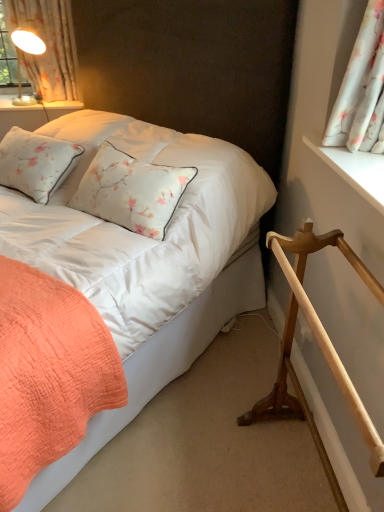
The image size is (384, 512). What do you see at coordinates (321, 323) in the screenshot?
I see `light brown wooden rail at lower right` at bounding box center [321, 323].

In order to face coral quilted bed at lower left, should I rotate leftwards or rightwards?

You should rotate left by 19.149 degrees.

Describe the element at coordinates (145, 262) in the screenshot. The image size is (384, 512). I see `coral quilted bed at lower left` at that location.

What is the approximate width of white wooden window sill at upper right?

white wooden window sill at upper right is 7.84 inches in width.

Identify the location of light brown wooden rail at lower right. The height and width of the screenshot is (512, 384). (321, 323).

Considering the points (288, 325) and (339, 144), which point is in front, point (288, 325) or point (339, 144)?

Positioned in front is point (288, 325).

Is light brown wooden rail at lower right not within white floral fabric at upper right, which is the first curtain in bottom-to-top order?

light brown wooden rail at lower right is positioned outside white floral fabric at upper right, which is the first curtain in bottom-to-top order.

Can you confirm if light brown wooden rail at lower right is bigger than white floral fabric at upper right, which is counted as the first curtain, starting from the front?

Correct, light brown wooden rail at lower right is larger in size than white floral fabric at upper right, which is counted as the first curtain, starting from the front.

From the picture: Is light brown wooden rail at lower right behind white floral fabric at upper right, the 2th curtain when ordered from back to front?

No, the depth of light brown wooden rail at lower right is less than that of white floral fabric at upper right, the 2th curtain when ordered from back to front.

Are light brown wooden rail at lower right and coral quilted bed at lower left far apart?

No.

From a real-world perspective, relative to coral quilted bed at lower left, is light brown wooden rail at lower right vertically above or below?

light brown wooden rail at lower right is below coral quilted bed at lower left.

From the image's perspective, is light brown wooden rail at lower right over coral quilted bed at lower left?

No, from the image's perspective, light brown wooden rail at lower right is not above coral quilted bed at lower left.

Considering the relative positions of light brown wooden rail at lower right and coral quilted bed at lower left in the image provided, is light brown wooden rail at lower right to the right of coral quilted bed at lower left from the viewer's perspective?

Correct, you'll find light brown wooden rail at lower right to the right of coral quilted bed at lower left.

Consider the image. Does white wooden window sill at upper right have a lesser width compared to white floral fabric at upper left, which ranks as the 2th curtain in right-to-left order?

Correct, the width of white wooden window sill at upper right is less than that of white floral fabric at upper left, which ranks as the 2th curtain in right-to-left order.

Considering the positions of points (363, 189) and (21, 19), is point (363, 189) closer to camera compared to point (21, 19)?

Yes, it is in front of point (21, 19).

Is white wooden window sill at upper right positioned with its back to white floral fabric at upper left, the first curtain in the top-to-bottom sequence?

That's not correct — white wooden window sill at upper right is not looking away from white floral fabric at upper left, the first curtain in the top-to-bottom sequence.

Between white wooden window sill at upper right and white floral fabric at upper left, which ranks as the first curtain in back-to-front order, which one appears on the right side from the viewer's perspective?

white wooden window sill at upper right.

Can you confirm if white wooden window sill at upper right is shorter than white floral fabric at upper right, which is counted as the first curtain, starting from the front?

Yes.

How different are the orientations of white wooden window sill at upper right and white floral fabric at upper right, the 2th curtain when ordered from back to front, in degrees?

The angular difference between white wooden window sill at upper right and white floral fabric at upper right, the 2th curtain when ordered from back to front, is 0.00205 degrees.

From the image's perspective, relative to white floral fabric at upper right, the 2th curtain when ordered from back to front, is white wooden window sill at upper right above or below?

Clearly, from the image's perspective, white wooden window sill at upper right is below white floral fabric at upper right, the 2th curtain when ordered from back to front.

Locate an element on the screen. curtain lying on the right of white wooden window sill at upper right is located at coordinates pos(359,82).

From the image's perspective, which is below, white floral fabric at upper left, which ranks as the first curtain in back-to-front order, or white floral fabric at upper right, the 2th curtain when ordered from back to front?

white floral fabric at upper right, the 2th curtain when ordered from back to front, from the image's perspective.

Is white floral fabric at upper left, which ranks as the first curtain in back-to-front order, shorter than white floral fabric at upper right, which is the first curtain in bottom-to-top order?

Incorrect, the height of white floral fabric at upper left, which ranks as the first curtain in back-to-front order, does not fall short of that of white floral fabric at upper right, which is the first curtain in bottom-to-top order.

Is white floral fabric at upper left, the 2th curtain in the bottom-to-top sequence, wider than white floral fabric at upper right, which ranks as the second curtain in left-to-right order?

No, white floral fabric at upper left, the 2th curtain in the bottom-to-top sequence, is not wider than white floral fabric at upper right, which ranks as the second curtain in left-to-right order.

Is white floral fabric at upper left, acting as the second curtain starting from the front, in front of or behind white floral fabric at upper right, the 2th curtain when ordered from back to front, in the image?

In the image, white floral fabric at upper left, acting as the second curtain starting from the front, appears behind white floral fabric at upper right, the 2th curtain when ordered from back to front.

Is white floral fabric at upper right, which ranks as the second curtain in left-to-right order, bigger or smaller than white wooden window sill at upper right?

In the image, white floral fabric at upper right, which ranks as the second curtain in left-to-right order, appears to be larger than white wooden window sill at upper right.

Identify the location of window sill below the white floral fabric at upper right, which is the first curtain in bottom-to-top order (from the image's perspective). (354, 169).

Looking at their sizes, would you say white floral fabric at upper right, which is counted as the first curtain, starting from the front, is wider or thinner than white wooden window sill at upper right?

Considering their sizes, white floral fabric at upper right, which is counted as the first curtain, starting from the front, looks broader than white wooden window sill at upper right.

Can white wooden window sill at upper right be found inside white floral fabric at upper right, which is counted as the first curtain, starting from the front?

No.

Is white wooden window sill at upper right at the left side of coral quilted bed at lower left?

No, white wooden window sill at upper right is not to the left of coral quilted bed at lower left.

Does white wooden window sill at upper right lie in front of coral quilted bed at lower left?

No, white wooden window sill at upper right is further to the viewer.

How many degrees apart are the facing directions of white wooden window sill at upper right and coral quilted bed at lower left?

The angular difference between white wooden window sill at upper right and coral quilted bed at lower left is 45.7 degrees.

Is white wooden window sill at upper right wider than coral quilted bed at lower left?

In fact, white wooden window sill at upper right might be narrower than coral quilted bed at lower left.

Where is `rail on the left of white floral fabric at upper right, the 2th curtain when ordered from back to front`? rail on the left of white floral fabric at upper right, the 2th curtain when ordered from back to front is located at coordinates (321, 323).

Locate an element on the screen. This screenshot has height=512, width=384. bed in front of the light brown wooden rail at lower right is located at coordinates (145, 262).

Looking at the image, which one is located further to coral quilted bed at lower left, light brown wooden rail at lower right or white floral fabric at upper right, the second curtain from the top?

Among the two, white floral fabric at upper right, the second curtain from the top, is located further to coral quilted bed at lower left.

Based on their spatial positions, is coral quilted bed at lower left or white floral fabric at upper right, the second curtain from the top, closer to white wooden window sill at upper right?

Among the two, white floral fabric at upper right, the second curtain from the top, is located nearer to white wooden window sill at upper right.

From the image, which object appears to be farther from white floral fabric at upper left, the 2th curtain in the bottom-to-top sequence, light brown wooden rail at lower right or white floral fabric at upper right, which is counted as the first curtain, starting from the front?

light brown wooden rail at lower right lies further to white floral fabric at upper left, the 2th curtain in the bottom-to-top sequence, than the other object.

Looking at the image, which one is located closer to light brown wooden rail at lower right, white floral fabric at upper right, the second curtain from the top, or white wooden window sill at upper right?

white wooden window sill at upper right is positioned closer to the anchor light brown wooden rail at lower right.

Based on their spatial positions, is light brown wooden rail at lower right or white floral fabric at upper right, the 2th curtain when ordered from back to front, further from white wooden window sill at upper right?

light brown wooden rail at lower right is further to white wooden window sill at upper right.

Estimate the real-world distances between objects in this image. Which object is closer to light brown wooden rail at lower right, white floral fabric at upper left, which ranks as the 2th curtain in right-to-left order, or coral quilted bed at lower left?

Among the two, coral quilted bed at lower left is located nearer to light brown wooden rail at lower right.

Consider the image. Looking at the image, which one is located closer to white floral fabric at upper left, which ranks as the first curtain in back-to-front order, coral quilted bed at lower left or white floral fabric at upper right, which ranks as the first curtain in right-to-left order?

coral quilted bed at lower left lies closer to white floral fabric at upper left, which ranks as the first curtain in back-to-front order, than the other object.

Estimate the real-world distances between objects in this image. Which object is closer to white floral fabric at upper left, which is the 1th curtain in left-to-right order, white wooden window sill at upper right or coral quilted bed at lower left?

Based on the image, coral quilted bed at lower left appears to be nearer to white floral fabric at upper left, which is the 1th curtain in left-to-right order.

Identify the location of curtain between light brown wooden rail at lower right and white floral fabric at upper left, the first curtain in the top-to-bottom sequence, from front to back. (359, 82).

You are a GUI agent. You are given a task and a screenshot of the screen. Output one action in this format:
    pyautogui.click(x=<x>, y=<y>)
    Task: Click on the rail between coral quilted bed at lower left and white wooden window sill at upper right
    
    Given the screenshot: What is the action you would take?
    pyautogui.click(x=321, y=323)

Locate an element on the screen. This screenshot has height=512, width=384. window sill between white floral fabric at upper right, which is counted as the first curtain, starting from the front, and light brown wooden rail at lower right, in the vertical direction is located at coordinates pos(354,169).

What are the coordinates of `curtain between coral quilted bed at lower left and white floral fabric at upper left, acting as the second curtain starting from the front, along the z-axis` in the screenshot? It's located at (359, 82).